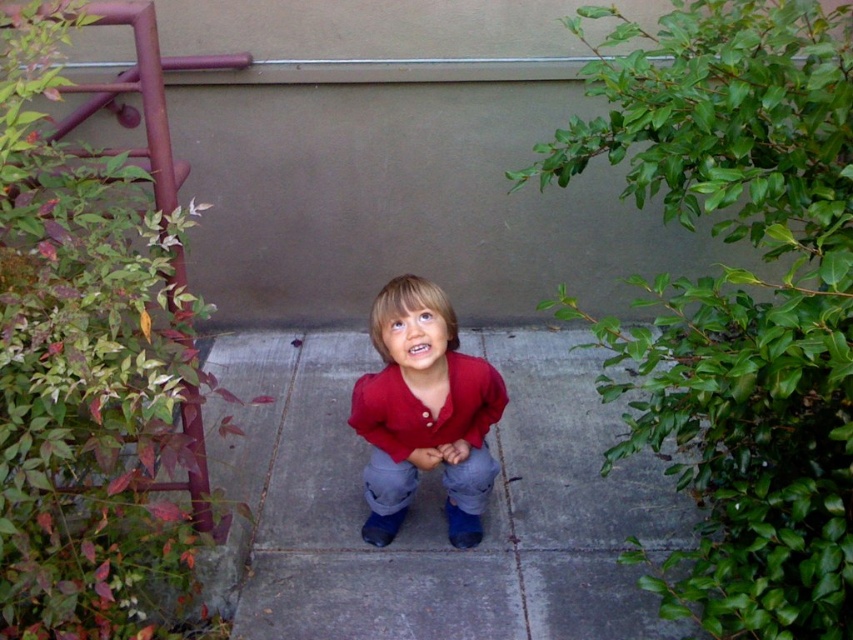
A child is standing on the gray concrete pavement at center and wearing the matte red shirt at center. Which object is closer to the ground?

The gray concrete pavement at center is located below the matte red shirt at center, so it is closer to the ground.

The child is wearing a matte red shirt at center and denim jeans at center. Which clothing item is higher up on the child?

The matte red shirt at center is much taller as denim jeans at center, so the matte red shirt at center is higher up on the child.